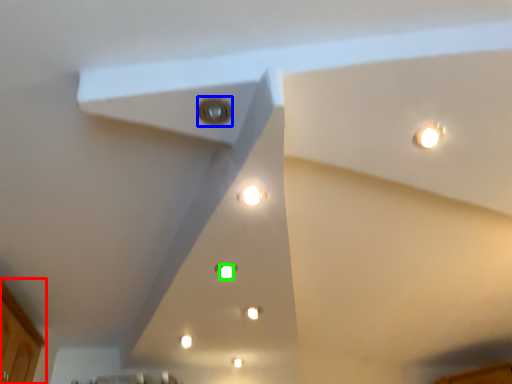
Question: Which is nearer to the cabinetry (highlighted by a red box)? light (highlighted by a blue box) or light (highlighted by a green box).

Choices:
 (A) light
 (B) light

Answer: (B)